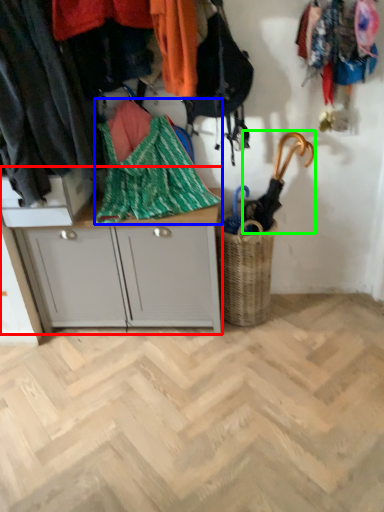
Question: Which is nearer to the desk (highlighted by a red box)? blanket (highlighted by a blue box) or umbrella (highlighted by a green box).

Choices:
 (A) blanket
 (B) umbrella

Answer: (A)